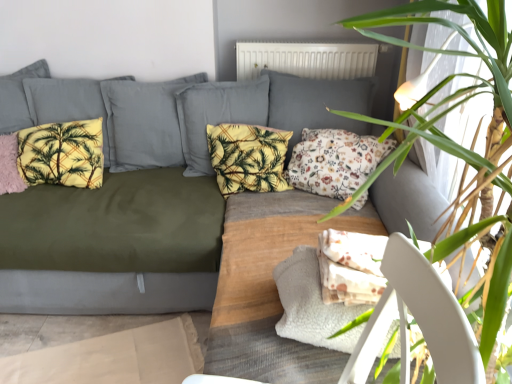
Question: Is pink fluffy pillow at left, placed as the 1th pillow when sorted from left to right, taller than yellow fabric pillow at center, positioned as the third pillow in left-to-right order?

Choices:
 (A) yes
 (B) no

Answer: (B)

Question: Considering the relative sizes of pink fluffy pillow at left, the fourth pillow positioned from the right, and yellow fabric pillow at center, marked as the second pillow in a right-to-left arrangement, in the image provided, is pink fluffy pillow at left, the fourth pillow positioned from the right, bigger than yellow fabric pillow at center, marked as the second pillow in a right-to-left arrangement,?

Choices:
 (A) no
 (B) yes

Answer: (A)

Question: Is pink fluffy pillow at left, placed as the 1th pillow when sorted from left to right, facing towards yellow fabric pillow at center, marked as the second pillow in a right-to-left arrangement?

Choices:
 (A) yes
 (B) no

Answer: (B)

Question: Is pink fluffy pillow at left, placed as the 1th pillow when sorted from left to right, at the left side of yellow fabric pillow at center, marked as the second pillow in a right-to-left arrangement?

Choices:
 (A) yes
 (B) no

Answer: (A)

Question: Is pink fluffy pillow at left, the fourth pillow positioned from the right, thinner than yellow fabric pillow at center, positioned as the third pillow in left-to-right order?

Choices:
 (A) no
 (B) yes

Answer: (A)

Question: From a real-world perspective, is yellow fleece pillow at left, marked as the 3th pillow in a right-to-left arrangement, positioned above or below green leafy plant at upper right?

Choices:
 (A) below
 (B) above

Answer: (A)

Question: Is yellow fleece pillow at left, marked as the 3th pillow in a right-to-left arrangement, inside the boundaries of green leafy plant at upper right, or outside?

Choices:
 (A) inside
 (B) outside

Answer: (B)

Question: Is yellow fleece pillow at left, marked as the 3th pillow in a right-to-left arrangement, bigger or smaller than green leafy plant at upper right?

Choices:
 (A) small
 (B) big

Answer: (A)

Question: Is point (20, 167) positioned closer to the camera than point (492, 41)?

Choices:
 (A) closer
 (B) farther

Answer: (B)

Question: Looking at the image, does pink fluffy pillow at left, placed as the 1th pillow when sorted from left to right, seem bigger or smaller compared to floral fabric pillow at center, acting as the 1th pillow starting from the right?

Choices:
 (A) big
 (B) small

Answer: (B)

Question: In terms of height, does pink fluffy pillow at left, placed as the 1th pillow when sorted from left to right, look taller or shorter compared to floral fabric pillow at center, acting as the 1th pillow starting from the right?

Choices:
 (A) short
 (B) tall

Answer: (A)

Question: Based on their positions, is pink fluffy pillow at left, the fourth pillow positioned from the right, located to the left or right of floral fabric pillow at center, arranged as the fourth pillow when viewed from the left?

Choices:
 (A) right
 (B) left

Answer: (B)

Question: In the image, is pink fluffy pillow at left, the fourth pillow positioned from the right, positioned in front of or behind floral fabric pillow at center, arranged as the fourth pillow when viewed from the left?

Choices:
 (A) behind
 (B) front

Answer: (A)

Question: Is white matte radiator at upper center inside the boundaries of floral fabric pillow at center, acting as the 1th pillow starting from the right, or outside?

Choices:
 (A) inside
 (B) outside

Answer: (B)

Question: From a real-world perspective, is white matte radiator at upper center above or below floral fabric pillow at center, acting as the 1th pillow starting from the right?

Choices:
 (A) above
 (B) below

Answer: (A)